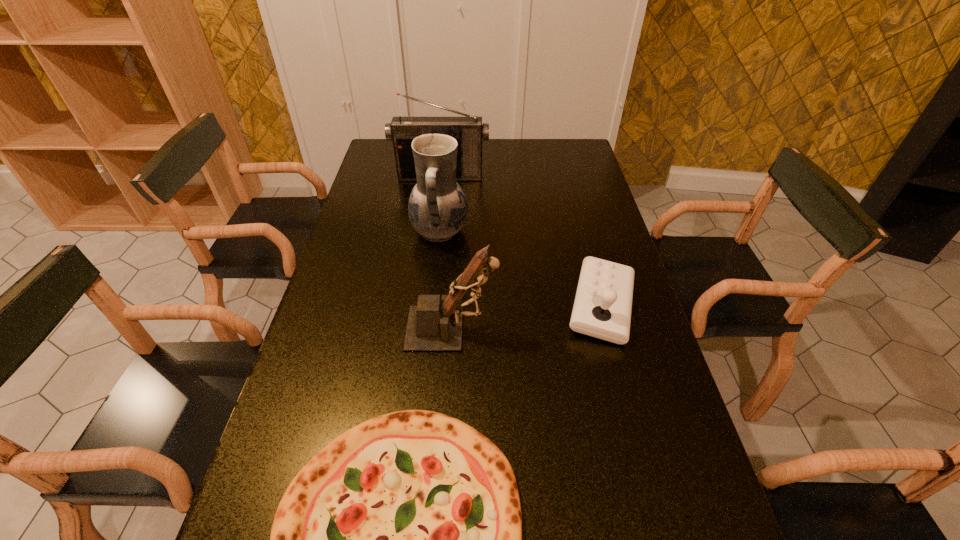
Locate an element on the screen. This screenshot has height=540, width=960. the farthest object is located at coordinates (468, 131).

The height and width of the screenshot is (540, 960). Find the location of `pitcher`. pitcher is located at coordinates (437, 208).

The height and width of the screenshot is (540, 960). In order to click on figurine in this screenshot , I will do `click(434, 325)`.

Identify the location of the rightmost object. This screenshot has width=960, height=540. (602, 308).

Find the location of a particular element. the second shortest object is located at coordinates (602, 308).

At what (x,y) coordinates should I click in order to perform the action: click on vacant area located 0.160m on the front-facing side of the radio receiver. Please return your answer as a coordinate pair (x, y). The image size is (960, 540). Looking at the image, I should click on click(x=437, y=207).

The width and height of the screenshot is (960, 540). Identify the location of free spot located on the front-facing side of the second farthest object. (549, 232).

I want to click on vacant region located on the front-facing side of the figurine, so click(528, 329).

At what (x,y) coordinates should I click in order to perform the action: click on vacant area situated on the back of the second shortest object. Please return your answer as a coordinate pair (x, y). Looking at the image, I should click on (587, 250).

The image size is (960, 540). Identify the location of object at the left edge. (468, 131).